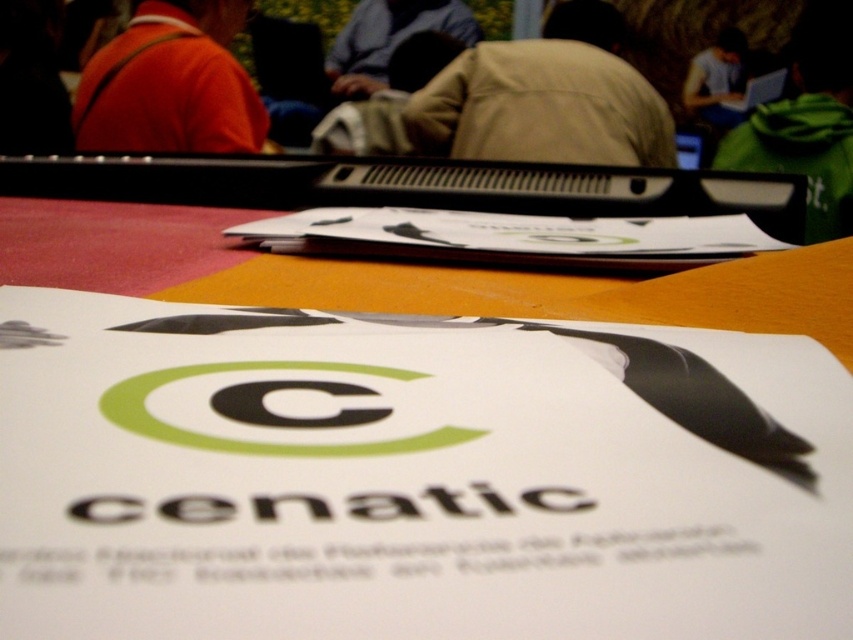
Between white paper at center and blue fabric shirt at upper center, which one is positioned lower?

white paper at center is lower down.

Can you confirm if white paper at center is positioned to the left of blue fabric shirt at upper center?

Incorrect, white paper at center is not on the left side of blue fabric shirt at upper center.

Which is in front, point (836, 476) or point (436, 3)?

Point (836, 476)

You are a GUI agent. You are given a task and a screenshot of the screen. Output one action in this format:
    pyautogui.click(x=<x>, y=<y>)
    Task: Click on the white paper at center
    The image size is (853, 640).
    Given the screenshot: What is the action you would take?
    pyautogui.click(x=407, y=477)

Is beige fabric jacket at center smaller than green fleece jacket at upper right?

Yes, beige fabric jacket at center is smaller than green fleece jacket at upper right.

Is beige fabric jacket at center below green fleece jacket at upper right?

No.

Between point (607, 77) and point (822, 106), which one is positioned behind?

Positioned behind is point (822, 106).

What are the coordinates of `beige fabric jacket at center` in the screenshot? It's located at (544, 99).

Is white matte laptop at upper right bigger than black plastic laptop at upper center?

Yes, white matte laptop at upper right is bigger than black plastic laptop at upper center.

Between point (723, 122) and point (781, 92), which one is positioned in front?

Positioned in front is point (781, 92).

You are a GUI agent. You are given a task and a screenshot of the screen. Output one action in this format:
    pyautogui.click(x=<x>, y=<y>)
    Task: Click on the white matte laptop at upper right
    The image size is (853, 640).
    Given the screenshot: What is the action you would take?
    pyautogui.click(x=717, y=81)